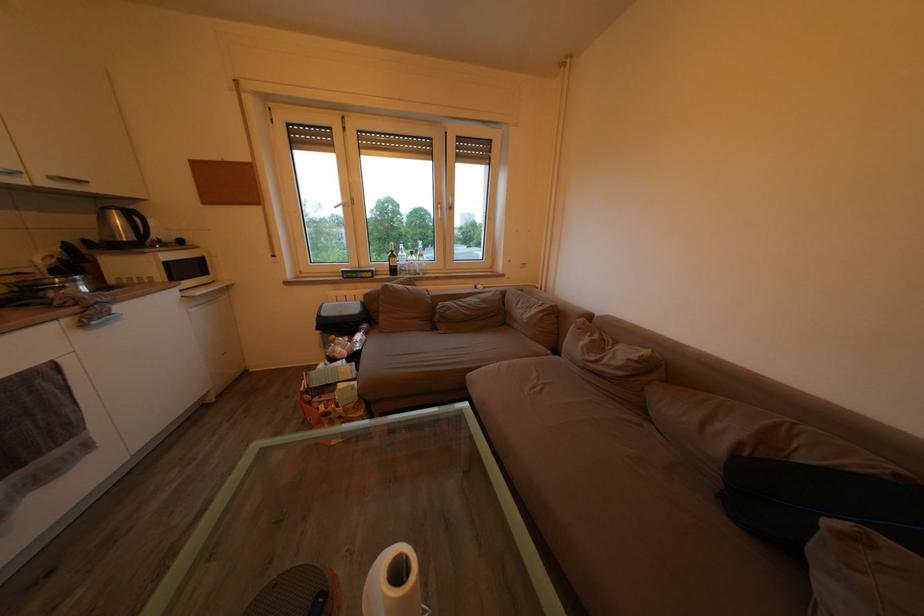
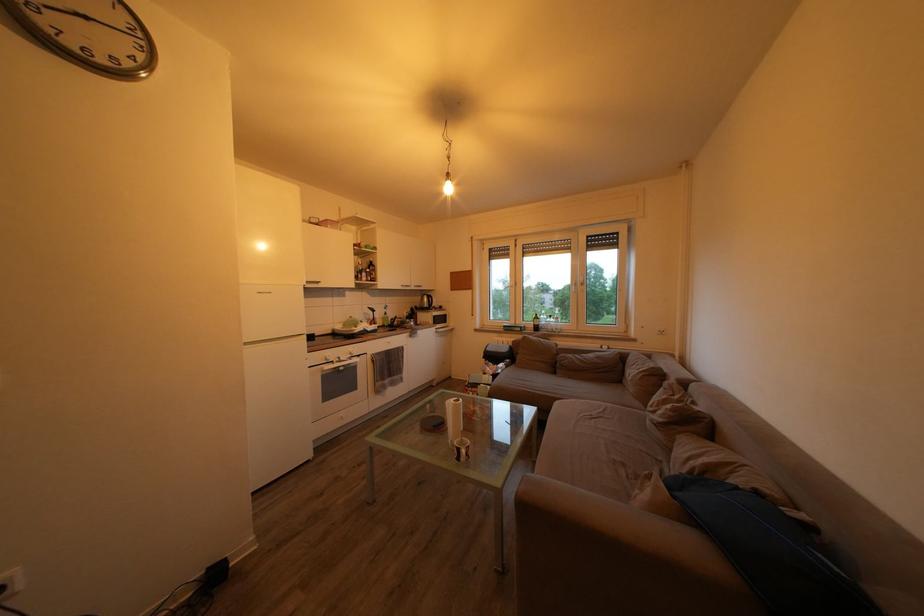
Find the pixel in the second image that matches the point at 199,275 in the first image.

(448, 326)